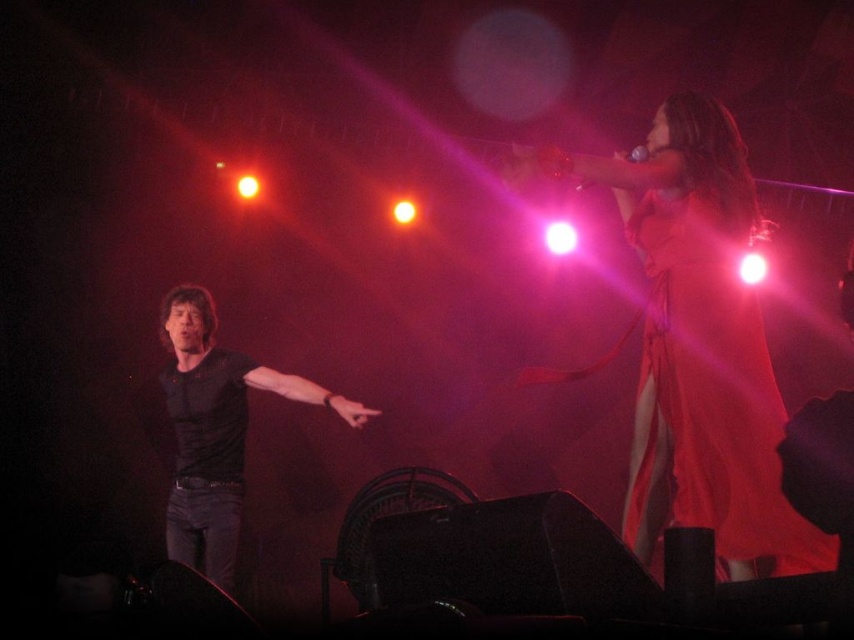
Question: Which point is closer to the camera?

Choices:
 (A) (692, 365)
 (B) (230, 420)

Answer: (A)

Question: Which point appears closest to the camera in this image?

Choices:
 (A) (225, 408)
 (B) (648, 387)

Answer: (B)

Question: Can you confirm if silky red dress at upper right is positioned to the right of black matte shirt at left?

Choices:
 (A) yes
 (B) no

Answer: (A)

Question: Can you confirm if silky red dress at upper right is bigger than black matte shirt at left?

Choices:
 (A) no
 (B) yes

Answer: (A)

Question: Does silky red dress at upper right appear over black matte shirt at left?

Choices:
 (A) yes
 (B) no

Answer: (A)